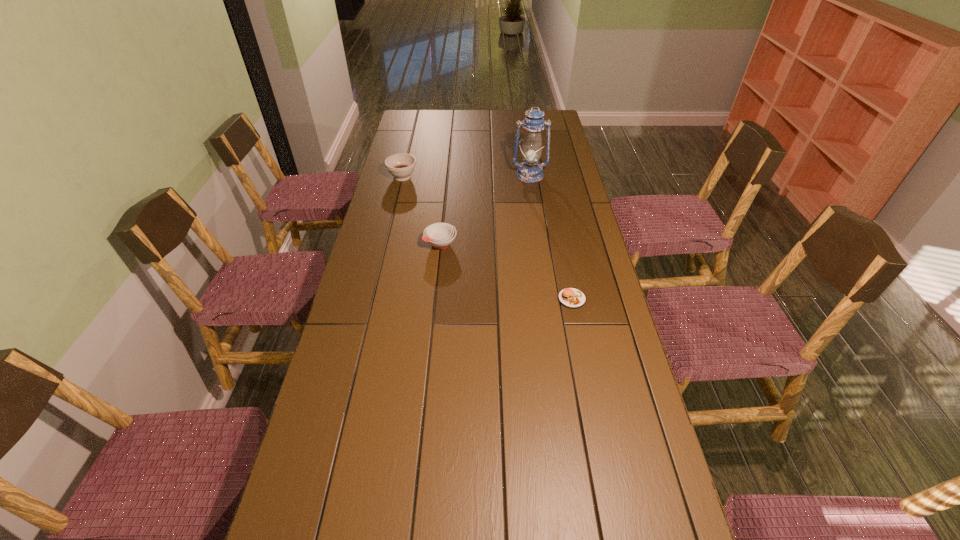
This screenshot has width=960, height=540. In order to click on free spot between the lantern and the patty in this screenshot , I will do `click(551, 237)`.

This screenshot has width=960, height=540. I want to click on vacant space in between the lantern and the shortest object, so click(551, 237).

Where is `vacant area that lies between the third shortest object and the shortest object`? This screenshot has height=540, width=960. vacant area that lies between the third shortest object and the shortest object is located at coordinates (487, 238).

What are the coordinates of `free spot between the tallest object and the shorter soup bowl` in the screenshot? It's located at (485, 210).

Locate an element on the screen. The width and height of the screenshot is (960, 540). empty space between the lantern and the nearest object is located at coordinates (551, 237).

Where is `free spot between the nearest object and the third shortest object`? This screenshot has height=540, width=960. free spot between the nearest object and the third shortest object is located at coordinates (487, 238).

Locate an element on the screen. free space between the patty and the third farthest object is located at coordinates (506, 271).

Find the location of a particular element. This screenshot has width=960, height=540. vacant area between the shortest object and the second nearest object is located at coordinates (506, 271).

At what (x,y) coordinates should I click in order to perform the action: click on the second closest object relative to the second tallest object. Please return your answer as a coordinate pair (x, y). Looking at the image, I should click on (530, 171).

Select which object appears as the second closest to the patty. Please provide its 2D coordinates. Your answer should be formatted as a tuple, i.e. [(x, y)], where the tuple contains the x and y coordinates of a point satisfying the conditions above.

[(530, 171)]